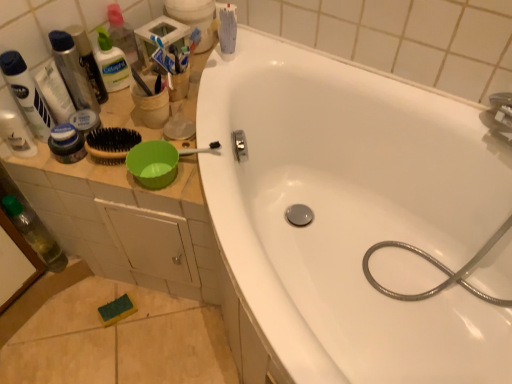
Identify the location of brown bristle brush at upper left. (141, 82).

You are a GUI agent. You are given a task and a screenshot of the screen. Output one action in this format:
    pyautogui.click(x=<x>, y=<y>)
    Task: Click on the white glossy bathtub at upper center
    The image size is (512, 384).
    Given the screenshot: What is the action you would take?
    pyautogui.click(x=351, y=214)

Where is `translucent plastic bottle at upper left, placed as the fourth toiletry when sorted from right to left`? The image size is (512, 384). translucent plastic bottle at upper left, placed as the fourth toiletry when sorted from right to left is located at coordinates (16, 134).

Where is `green matte mouthwash at upper left`? green matte mouthwash at upper left is located at coordinates (112, 63).

Is matte white tube at upper left, the 2th toiletry viewed from the left, directly adjacent to clear plastic bottle at upper left, which is the 1th bottle in right-to-left order?

matte white tube at upper left, the 2th toiletry viewed from the left, and clear plastic bottle at upper left, which is the 1th bottle in right-to-left order, are not in contact.

In terms of height, does matte white tube at upper left, the third toiletry from the right, look taller or shorter compared to clear plastic bottle at upper left, the 2th bottle positioned from the bottom?

In the image, matte white tube at upper left, the third toiletry from the right, appears to be taller than clear plastic bottle at upper left, the 2th bottle positioned from the bottom.

From a real-world perspective, which is physically above, matte white tube at upper left, the third toiletry from the right, or clear plastic bottle at upper left, the 2th bottle positioned from the bottom?

matte white tube at upper left, the third toiletry from the right.

How different are the orientations of matte white tube at upper left, the 2th toiletry viewed from the left, and clear plastic bottle at upper left, the 2th bottle positioned from the bottom, in degrees?

0.00183 degrees.

Which object is further away from the camera taking this photo, clear plastic bottle at upper left, which is the 1th bottle in right-to-left order, or brown bristle brush at upper left?

clear plastic bottle at upper left, which is the 1th bottle in right-to-left order, is behind.

Is clear plastic bottle at upper left, positioned as the second bottle in left-to-right order, located outside brown bristle brush at upper left?

Yes, clear plastic bottle at upper left, positioned as the second bottle in left-to-right order, is located beyond the bounds of brown bristle brush at upper left.

Considering the relative sizes of clear plastic bottle at upper left, which is the 1th bottle in right-to-left order, and brown bristle brush at upper left in the image provided, is clear plastic bottle at upper left, which is the 1th bottle in right-to-left order, thinner than brown bristle brush at upper left?

Yes, clear plastic bottle at upper left, which is the 1th bottle in right-to-left order, is thinner than brown bristle brush at upper left.

From the image's perspective, between clear plastic bottle at upper left, positioned as the second bottle in left-to-right order, and brown bristle brush at upper left, which one is located above?

clear plastic bottle at upper left, positioned as the second bottle in left-to-right order.

Measure the distance between white glossy bathtub at upper center and metallic silver garden hose at upper right.

white glossy bathtub at upper center is 9.06 inches from metallic silver garden hose at upper right.

Can you confirm if white glossy bathtub at upper center is bigger than metallic silver garden hose at upper right?

Indeed, white glossy bathtub at upper center has a larger size compared to metallic silver garden hose at upper right.

Considering the positions of objects white glossy bathtub at upper center and metallic silver garden hose at upper right in the image provided, who is more to the left, white glossy bathtub at upper center or metallic silver garden hose at upper right?

From the viewer's perspective, white glossy bathtub at upper center appears more on the left side.

Can you confirm if white glossy bathtub at upper center is thinner than metallic silver garden hose at upper right?

No.

Visually, is translucent plastic bottle at upper left, which is the first toiletry in left-to-right order, positioned to the left or to the right of green matte mouthwash at upper left?

In the image, translucent plastic bottle at upper left, which is the first toiletry in left-to-right order, appears on the left side of green matte mouthwash at upper left.

Could you measure the distance between translucent plastic bottle at upper left, which is the first toiletry in left-to-right order, and green matte mouthwash at upper left?

9.74 inches.

Which object is more forward, translucent plastic bottle at upper left, which is the first toiletry in left-to-right order, or green matte mouthwash at upper left?

Positioned in front is translucent plastic bottle at upper left, which is the first toiletry in left-to-right order.

From the image's perspective, does translucent plastic bottle at upper left, which is the first toiletry in left-to-right order, appear lower than green matte mouthwash at upper left?

Indeed, from the image's perspective, translucent plastic bottle at upper left, which is the first toiletry in left-to-right order, is shown beneath green matte mouthwash at upper left.

Which toiletry is the 3rd one when counting from the right side of the translucent plastic bottle at upper left, placed as the fourth toiletry when sorted from right to left? Please provide its 2D coordinates.

[(88, 61)]

Considering the relative positions of shiny metallic can at upper left, the 4th toiletry from the left, and translucent plastic bottle at upper left, placed as the fourth toiletry when sorted from right to left, in the image provided, is shiny metallic can at upper left, the 4th toiletry from the left, to the left of translucent plastic bottle at upper left, placed as the fourth toiletry when sorted from right to left, from the viewer's perspective?

No, shiny metallic can at upper left, the 4th toiletry from the left, is not to the left of translucent plastic bottle at upper left, placed as the fourth toiletry when sorted from right to left.

From a real-world perspective, between shiny metallic can at upper left, the 1th toiletry viewed from the right, and translucent plastic bottle at upper left, which is the first toiletry in left-to-right order, who is vertically lower?

translucent plastic bottle at upper left, which is the first toiletry in left-to-right order, is physically lower.

Does shiny metallic can at upper left, the 1th toiletry viewed from the right, have a smaller size compared to translucent plastic bottle at upper left, placed as the fourth toiletry when sorted from right to left?

Incorrect, shiny metallic can at upper left, the 1th toiletry viewed from the right, is not smaller in size than translucent plastic bottle at upper left, placed as the fourth toiletry when sorted from right to left.

Which object is closer to the camera taking this photo, shiny metallic can at upper left, the 1th toiletry viewed from the right, or green plastic bottle at left, acting as the second bottle starting from the top?

shiny metallic can at upper left, the 1th toiletry viewed from the right, is in front.

From a real-world perspective, is shiny metallic can at upper left, the 4th toiletry from the left, on green plastic bottle at left, which is the second bottle in right-to-left order?

Yes, from a real-world perspective, shiny metallic can at upper left, the 4th toiletry from the left, is over green plastic bottle at left, which is the second bottle in right-to-left order

Between shiny metallic can at upper left, the 1th toiletry viewed from the right, and green plastic bottle at left, the 1th bottle when ordered from left to right, which one has less height?

shiny metallic can at upper left, the 1th toiletry viewed from the right, is shorter.

Considering the sizes of translucent plastic bottle at upper left, which is the first toiletry in left-to-right order, and clear plastic bottle at upper left, positioned as the second bottle in left-to-right order, in the image, is translucent plastic bottle at upper left, which is the first toiletry in left-to-right order, wider or thinner than clear plastic bottle at upper left, positioned as the second bottle in left-to-right order,?

translucent plastic bottle at upper left, which is the first toiletry in left-to-right order, is wider than clear plastic bottle at upper left, positioned as the second bottle in left-to-right order.

Which is more to the left, translucent plastic bottle at upper left, which is the first toiletry in left-to-right order, or clear plastic bottle at upper left, the 2th bottle positioned from the bottom?

From the viewer's perspective, translucent plastic bottle at upper left, which is the first toiletry in left-to-right order, appears more on the left side.

Considering the positions of point (17, 135) and point (139, 53), is point (17, 135) closer or farther from the camera than point (139, 53)?

Point (17, 135) is positioned closer to the camera compared to point (139, 53).

The height and width of the screenshot is (384, 512). I want to click on bottle above the matte white tube at upper left, the 2th toiletry viewed from the left (from the image's perspective), so click(123, 36).

Locate an element on the screen. brush that is in front of the clear plastic bottle at upper left, which is the 1th bottle in right-to-left order is located at coordinates (141, 82).

Which object lies further to the anchor point translucent plastic bottle at upper left, which is the first toiletry in left-to-right order, shiny metallic can at upper left, the 1th toiletry viewed from the right, or clear plastic bottle at upper left, marked as the first bottle in a top-to-bottom arrangement?

clear plastic bottle at upper left, marked as the first bottle in a top-to-bottom arrangement, is positioned further to the anchor translucent plastic bottle at upper left, which is the first toiletry in left-to-right order.

Based on their spatial positions, is matte black jar at left, the 3th toiletry viewed from the left, or shiny metallic can at upper left, the 4th toiletry from the left, closer to green matte mouthwash at upper left?

shiny metallic can at upper left, the 4th toiletry from the left, lies closer to green matte mouthwash at upper left than the other object.

When comparing their distances from metallic silver garden hose at upper right, does green matte mouthwash at upper left or matte black jar at left, the 2th toiletry viewed from the right, seem further?

green matte mouthwash at upper left is further to metallic silver garden hose at upper right.

Based on their spatial positions, is shiny metallic can at upper left, the 1th toiletry viewed from the right, or metallic silver garden hose at upper right further from clear plastic bottle at upper left, marked as the first bottle in a top-to-bottom arrangement?

metallic silver garden hose at upper right lies further to clear plastic bottle at upper left, marked as the first bottle in a top-to-bottom arrangement, than the other object.

Looking at the image, which one is located further to translucent plastic bottle at upper left, placed as the fourth toiletry when sorted from right to left, green plastic bottle at left, which is the second bottle in right-to-left order, or metallic silver garden hose at upper right?

The object further to translucent plastic bottle at upper left, placed as the fourth toiletry when sorted from right to left, is metallic silver garden hose at upper right.

Which object lies nearer to the anchor point metallic silver garden hose at upper right, translucent plastic bottle at upper left, which is the first toiletry in left-to-right order, or green plastic bottle at left, acting as the second bottle starting from the top?

The object closer to metallic silver garden hose at upper right is green plastic bottle at left, acting as the second bottle starting from the top.

Based on the photo, from the image, which object appears to be nearer to translucent plastic bottle at upper left, placed as the fourth toiletry when sorted from right to left, matte white tube at upper left, the 2th toiletry viewed from the left, or brown bristle brush at upper left?

Among the two, matte white tube at upper left, the 2th toiletry viewed from the left, is located nearer to translucent plastic bottle at upper left, placed as the fourth toiletry when sorted from right to left.

From the image, which object appears to be farther from translucent plastic bottle at upper left, which is the first toiletry in left-to-right order, green plastic bottle at left, the 1th bottle when ordered from left to right, or green matte mouthwash at upper left?

green plastic bottle at left, the 1th bottle when ordered from left to right, is further to translucent plastic bottle at upper left, which is the first toiletry in left-to-right order.

What are the coordinates of `brush positioned between white glossy bathtub at upper center and green matte mouthwash at upper left from near to far` in the screenshot? It's located at (141, 82).

Find the location of a particular element. mouthwash between matte black jar at left, the 2th toiletry viewed from the right, and white glossy bathtub at upper center is located at coordinates pos(112,63).

Where is `brush located between green plastic bottle at left, which is the second bottle in right-to-left order, and white glossy bathtub at upper center in the left-right direction`? brush located between green plastic bottle at left, which is the second bottle in right-to-left order, and white glossy bathtub at upper center in the left-right direction is located at coordinates (141, 82).

Where is `mouthwash between matte white tube at upper left, the 2th toiletry viewed from the left, and metallic silver garden hose at upper right`? mouthwash between matte white tube at upper left, the 2th toiletry viewed from the left, and metallic silver garden hose at upper right is located at coordinates (112, 63).